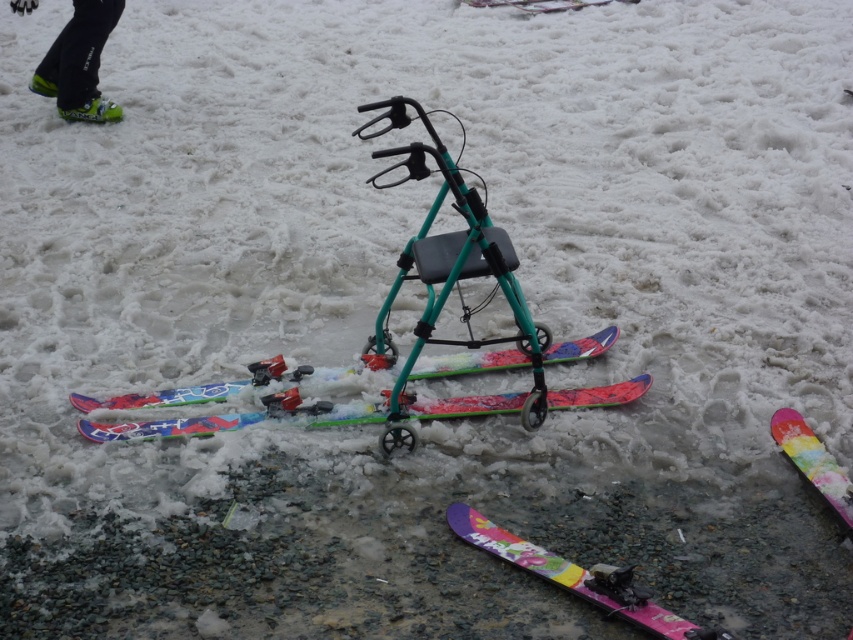
Question: Does shiny pink plastic ski at lower right come behind green matte ski boot at upper left?

Choices:
 (A) yes
 (B) no

Answer: (B)

Question: Which of the following is the closest to the observer?

Choices:
 (A) (811, 444)
 (B) (358, 416)
 (C) (466, 540)
 (D) (61, 67)

Answer: (C)

Question: Which object appears closest to the camera in this image?

Choices:
 (A) green matte ski boot at upper left
 (B) shiny pink plastic ski at lower right

Answer: (B)

Question: Which point is closer to the camera?

Choices:
 (A) pos(184,433)
 (B) pos(630,611)
 (C) pos(115,17)
 (D) pos(451,406)

Answer: (B)

Question: Is green matte ski boot at upper left below multicolored plastic ski at center?

Choices:
 (A) yes
 (B) no

Answer: (B)

Question: Is green matte ski boot at upper left thinner than multicolored plastic ski at center?

Choices:
 (A) yes
 (B) no

Answer: (A)